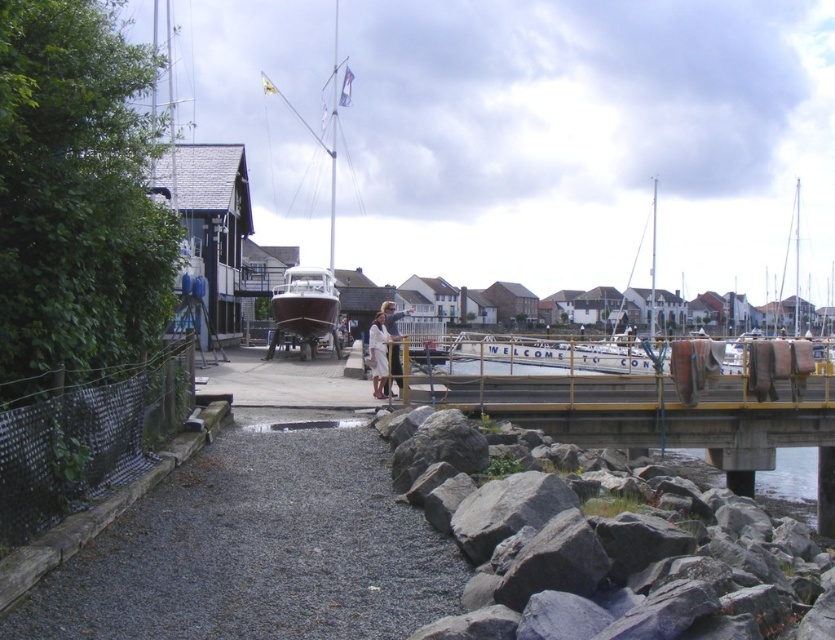
In the scene shown: Does white cotton dress at center have a lesser height compared to white fabric shirt at center?

Yes.

Between white cotton dress at center and white fabric shirt at center, which one has more height?

With more height is white fabric shirt at center.

Between point (383, 362) and point (398, 358), which one is positioned in front?

Point (398, 358) is more forward.

At what (x,y) coordinates should I click in order to perform the action: click on white cotton dress at center. Please return your answer as a coordinate pair (x, y). This screenshot has width=835, height=640. Looking at the image, I should click on (380, 348).

Is matte brown boat at center below white cotton dress at center?

Actually, matte brown boat at center is above white cotton dress at center.

Does matte brown boat at center appear over white cotton dress at center?

Yes, matte brown boat at center is above white cotton dress at center.

Is point (312, 298) closer to camera compared to point (375, 385)?

No, (312, 298) is further to viewer.

Where is `matte brown boat at center`? The image size is (835, 640). matte brown boat at center is located at coordinates (305, 304).

Is matte brown boat at center wider than white fabric shirt at center?

In fact, matte brown boat at center might be narrower than white fabric shirt at center.

Which is behind, point (277, 317) or point (398, 333)?

The point (398, 333) is more distant.

Between point (305, 307) and point (393, 307), which one is positioned behind?

The point (305, 307) is more distant.

Locate an element on the screen. The height and width of the screenshot is (640, 835). matte brown boat at center is located at coordinates (305, 304).